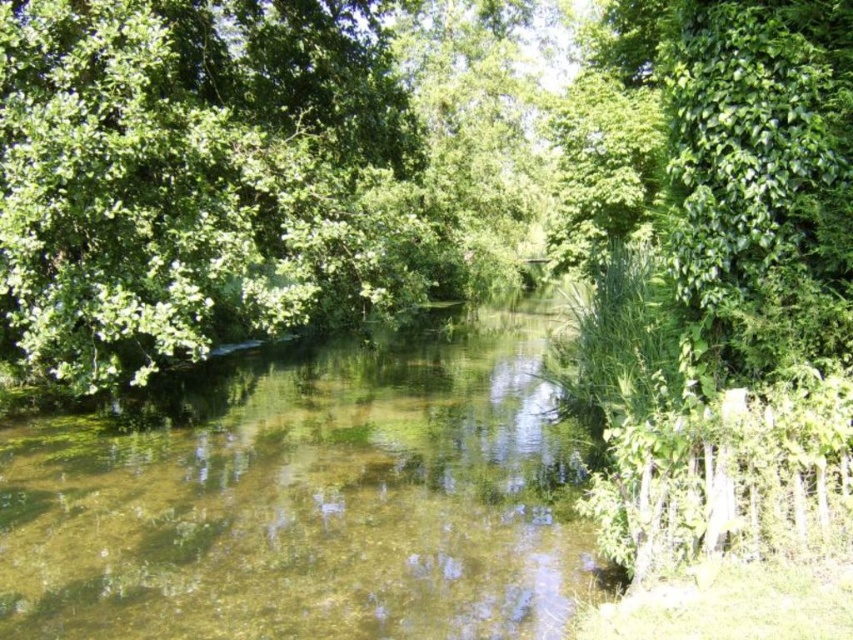
Question: Does green leafy tree at center appear over clear water at center?

Choices:
 (A) no
 (B) yes

Answer: (B)

Question: Can you confirm if green leafy tree at center is smaller than clear water at center?

Choices:
 (A) yes
 (B) no

Answer: (B)

Question: Which object appears closest to the camera in this image?

Choices:
 (A) green leafy tree at center
 (B) clear water at center

Answer: (B)

Question: Does green leafy tree at center appear under clear water at center?

Choices:
 (A) yes
 (B) no

Answer: (B)